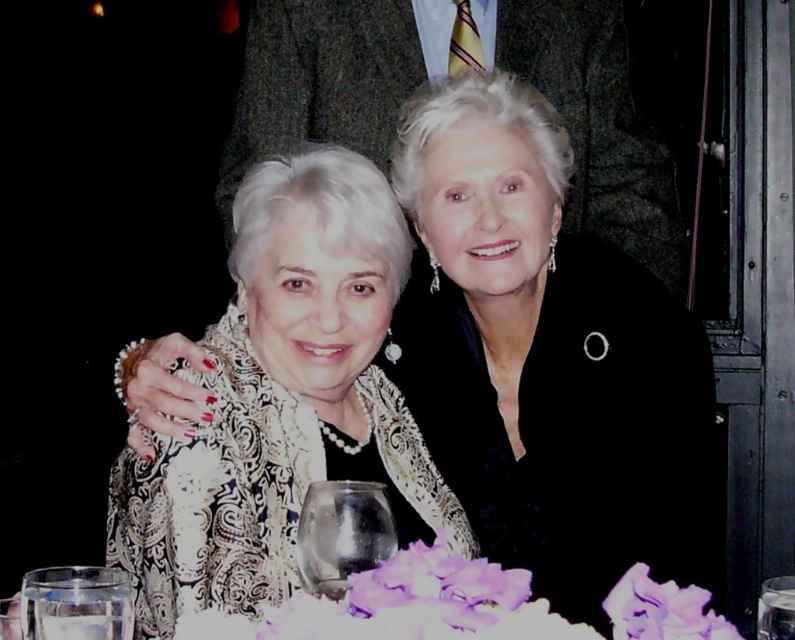
Question: Can you confirm if black satin dress at center is positioned below transparent glass wine glass at lower center?

Choices:
 (A) no
 (B) yes

Answer: (A)

Question: Which object is positioned closest to the transparent glass wine glass at lower center?

Choices:
 (A) clear glass wine glass at lower left
 (B) black satin dress at center
 (C) dark gray textured suit at upper center
 (D) white lace dress at center

Answer: (A)

Question: Which object is positioned farthest from the clear glass wine glass at lower left?

Choices:
 (A) black satin dress at center
 (B) transparent glass at center
 (C) white lace dress at center

Answer: (A)

Question: Does black satin dress at center appear on the left side of dark gray textured suit at upper center?

Choices:
 (A) yes
 (B) no

Answer: (B)

Question: Where is black satin dress at center located in relation to transparent glass wine glass at lower center in the image?

Choices:
 (A) right
 (B) left

Answer: (B)

Question: Based on their relative distances, which object is farther from the clear glass wine glass at lower left?

Choices:
 (A) white lace dress at center
 (B) transparent glass at center
 (C) dark gray textured suit at upper center

Answer: (C)